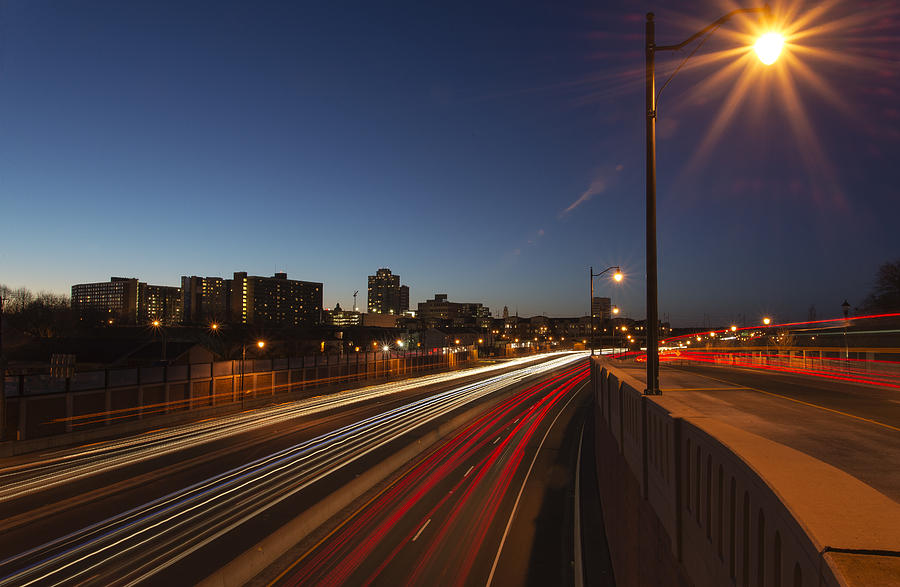
Locate an element on the screen. yellow color on top of railing is located at coordinates (796, 485).